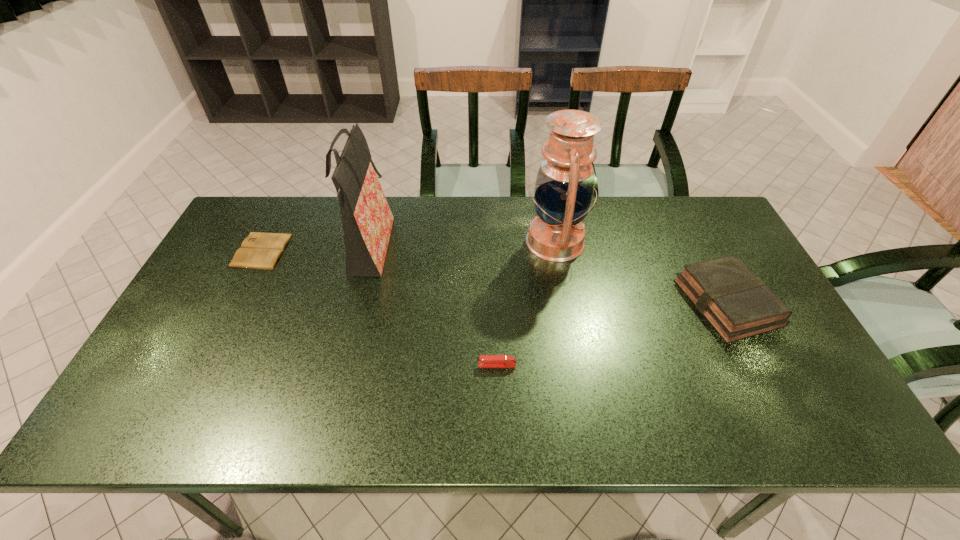
Locate an element on the screen. This screenshot has height=540, width=960. vacant space located on the left of the right book is located at coordinates (552, 302).

I want to click on free space located on the front-facing side of the nearest object, so tap(454, 365).

The height and width of the screenshot is (540, 960). In order to click on vacant space located on the front-facing side of the nearest object in this screenshot , I will do `click(326, 365)`.

Identify the location of free spot located 0.240m on the front-facing side of the nearest object. The image size is (960, 540). (380, 365).

The width and height of the screenshot is (960, 540). Find the location of `free space located on the right of the leftmost object`. free space located on the right of the leftmost object is located at coordinates (393, 251).

The width and height of the screenshot is (960, 540). What are the coordinates of `oil lamp at the far edge` in the screenshot? It's located at (564, 187).

I want to click on shopping bag located at the far edge, so (x=367, y=220).

At what (x,y) coordinates should I click in order to perform the action: click on book that is at the far edge. Please return your answer as a coordinate pair (x, y). Looking at the image, I should click on (262, 251).

Where is `object present at the left edge`? This screenshot has width=960, height=540. object present at the left edge is located at coordinates (262, 251).

Locate an element on the screen. The width and height of the screenshot is (960, 540). object at the right edge is located at coordinates (734, 300).